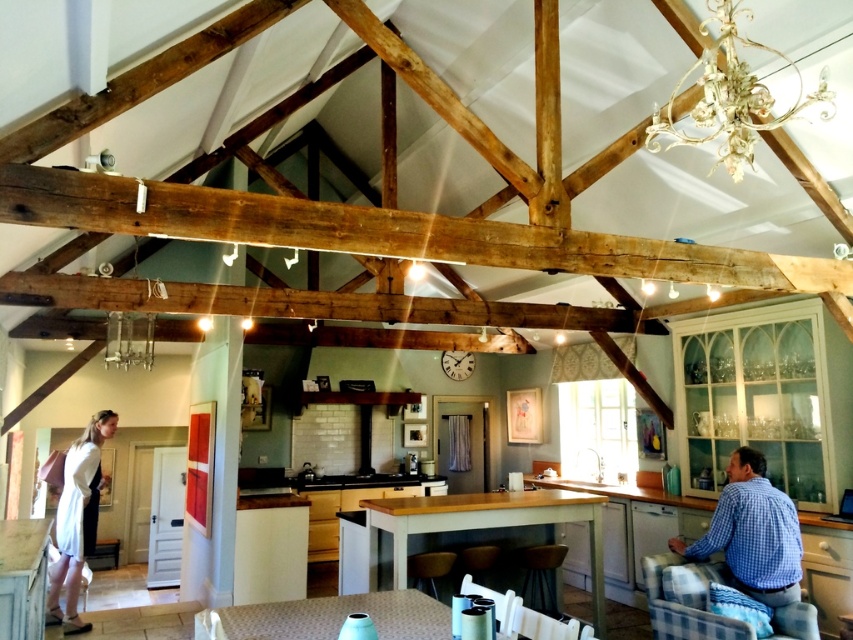
You are standing in the kitchen and see the blue checkered shirt at lower right. Where exactly is it located in the image?

The blue checkered shirt at lower right is located at point (752, 532) in the image.

In the scene shown: You are a guest in this rustic kitchen and dining area. You notice the blue checkered shirt at lower right and the metallic glass chandelier at upper center. Which object is taller?

The blue checkered shirt at lower right is much taller than the metallic glass chandelier at upper center.